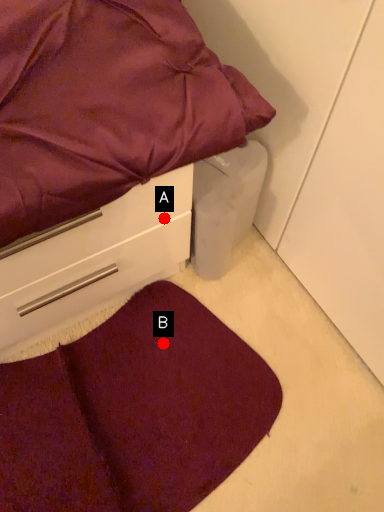
Question: Two points are circled on the image, labeled by A and B beside each circle. Which point is farther to the camera?

Choices:
 (A) A is further
 (B) B is further

Answer: (B)